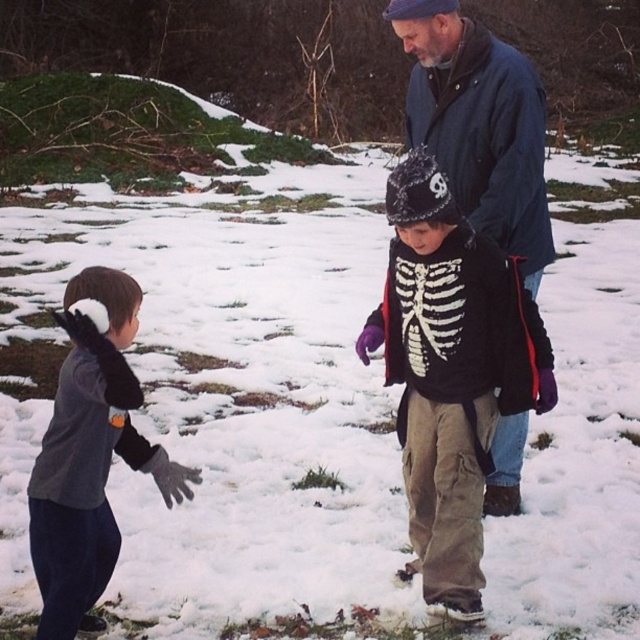
Does black cotton sweater with skeleton design at center appear under gray fleece shirt at left?

No.

Is black cotton sweater with skeleton design at center taller than gray fleece shirt at left?

Yes.

I want to click on black cotton sweater with skeleton design at center, so click(451, 372).

Where is `black cotton sweater with skeleton design at center`? The width and height of the screenshot is (640, 640). black cotton sweater with skeleton design at center is located at coordinates (451, 372).